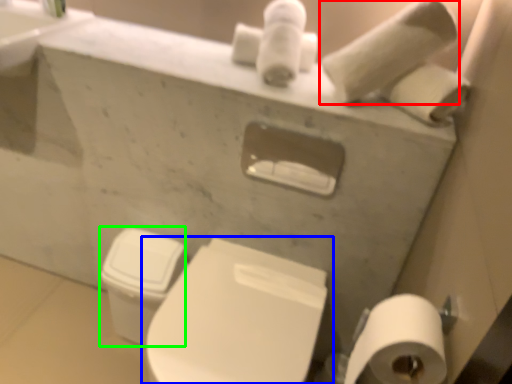
Question: Which is nearer to the toilet paper (highlighted by a red box)? toilet (highlighted by a blue box) or toilet bowl (highlighted by a green box).

Choices:
 (A) toilet
 (B) toilet bowl

Answer: (A)